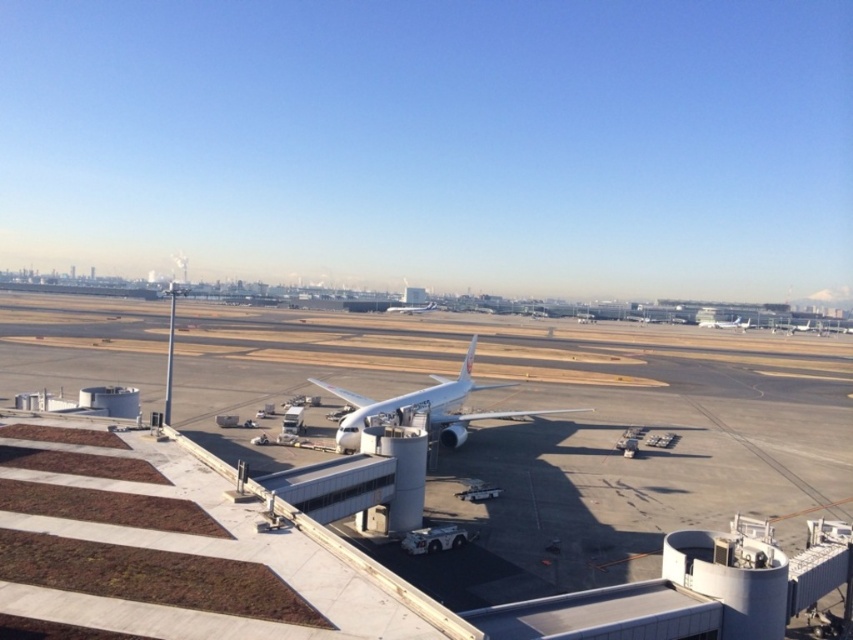
Question: Can you confirm if white glossy airplane at center is positioned to the left of white matte airplane at right?

Choices:
 (A) yes
 (B) no

Answer: (A)

Question: Can you confirm if white glossy airplane at center is smaller than white matte airplane at center?

Choices:
 (A) yes
 (B) no

Answer: (A)

Question: Which point is closer to the camera?

Choices:
 (A) (784, 323)
 (B) (389, 307)
 (C) (468, 348)

Answer: (C)

Question: Which point is closer to the camera taking this photo?

Choices:
 (A) (786, 332)
 (B) (473, 419)
 (C) (708, 320)
 (D) (685, 416)

Answer: (B)

Question: Considering the relative positions of white glossy airplane at center and white matte airplane at right in the image provided, where is white glossy airplane at center located with respect to white matte airplane at right?

Choices:
 (A) below
 (B) above

Answer: (A)

Question: Which point appears closest to the camera in this image?

Choices:
 (A) (445, 392)
 (B) (720, 316)
 (C) (793, 323)

Answer: (A)